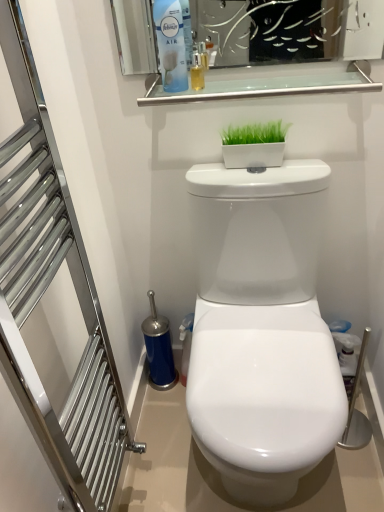
Image resolution: width=384 pixels, height=512 pixels. Find the location of `free region on the left part of white glossy rectangular planter at upper center`. free region on the left part of white glossy rectangular planter at upper center is located at coordinates (219, 172).